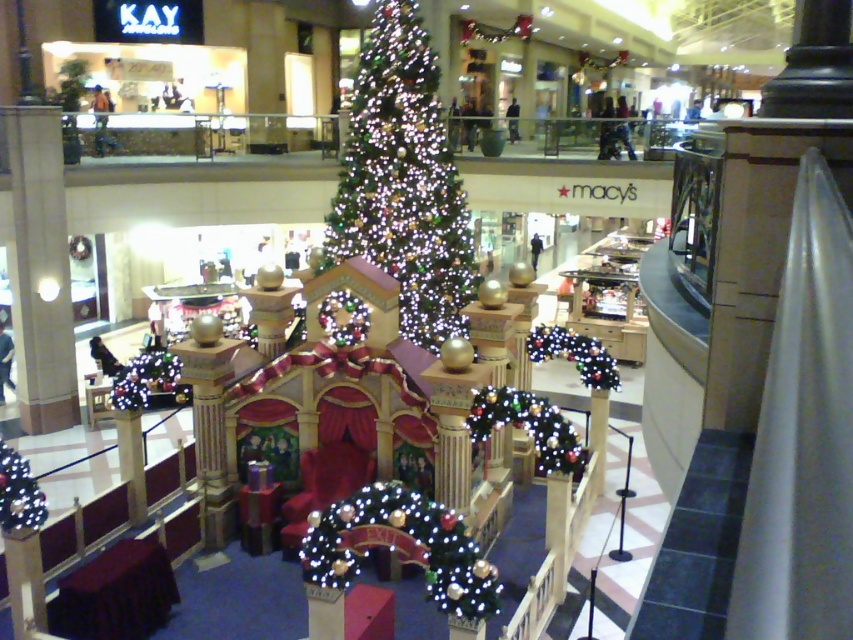
Question: Can you confirm if iridescent glass christmas tree at center is positioned to the right of illuminated garland at center?

Choices:
 (A) no
 (B) yes

Answer: (A)

Question: Among these points, which one is farthest from the camera?

Choices:
 (A) pos(550,406)
 (B) pos(390,541)
 (C) pos(25,486)

Answer: (A)

Question: Which of these objects is positioned closest to the illuminated fabric archway at center?

Choices:
 (A) illuminated garland at center
 (B) illuminated plastic garland at lower left

Answer: (A)

Question: Where is illuminated fabric archway at center located in relation to illuminated plastic garland at lower left in the image?

Choices:
 (A) left
 (B) right

Answer: (B)

Question: Which point is closer to the camera taking this photo?

Choices:
 (A) (436, 109)
 (B) (473, 404)
 (C) (25, 525)
 (D) (361, 545)

Answer: (D)

Question: Is the position of illuminated fabric archway at center less distant than that of illuminated plastic garland at lower left?

Choices:
 (A) yes
 (B) no

Answer: (A)